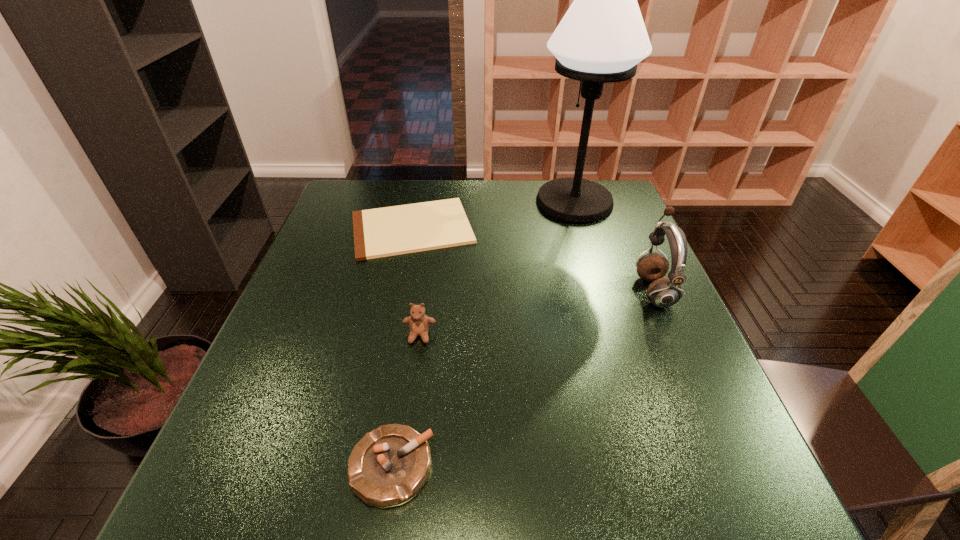
Identify the location of vacant space located on the ear pads of the third nearest object. (486, 290).

Image resolution: width=960 pixels, height=540 pixels. Find the location of `free space located on the ear pads of the third nearest object`. free space located on the ear pads of the third nearest object is located at coordinates (564, 290).

The width and height of the screenshot is (960, 540). I want to click on free region located on the front-facing side of the teddy bear, so click(x=410, y=406).

Locate an element on the screen. The height and width of the screenshot is (540, 960). free space located 0.340m on the back of the second shortest object is located at coordinates (418, 299).

The height and width of the screenshot is (540, 960). What are the coordinates of `vacant space located on the right of the shortest object` in the screenshot? It's located at (494, 228).

Locate an element on the screen. table lamp present at the far edge is located at coordinates (602, 37).

The height and width of the screenshot is (540, 960). I want to click on clipboard at the far edge, so click(389, 231).

Locate an element on the screen. The width and height of the screenshot is (960, 540). object situated at the near edge is located at coordinates (390, 464).

The height and width of the screenshot is (540, 960). I want to click on object at the left edge, so click(389, 231).

Locate an element on the screen. This screenshot has height=540, width=960. table lamp that is at the right edge is located at coordinates (602, 37).